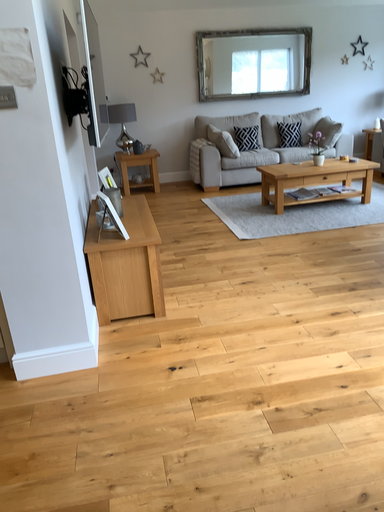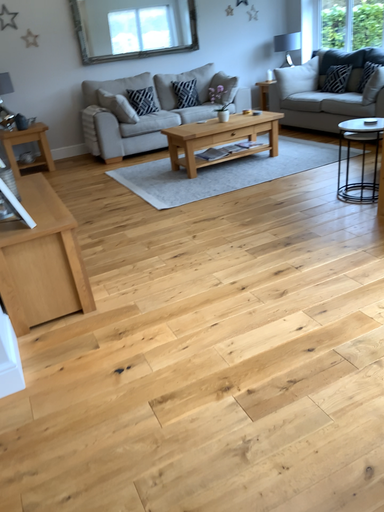
Question: How did the camera likely rotate when shooting the video?

Choices:
 (A) rotated left
 (B) rotated right

Answer: (B)